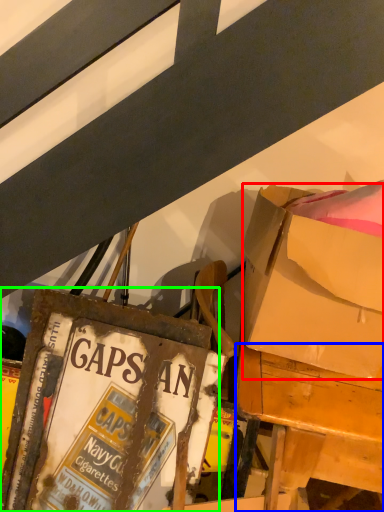
Question: Which object is positioned farthest from box (highlighted by a red box)? Select from desk (highlighted by a blue box) and paperback book (highlighted by a green box).

Choices:
 (A) desk
 (B) paperback book

Answer: (B)